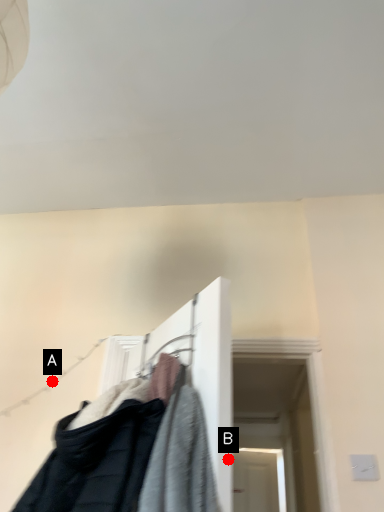
Question: Two points are circled on the image, labeled by A and B beside each circle. Which point is closer to the camera?

Choices:
 (A) A is closer
 (B) B is closer

Answer: (B)